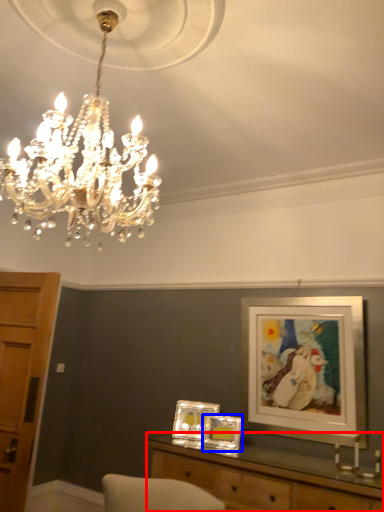
Question: Which object is closer to the camera taking this photo, table (highlighted by a red box) or picture frame (highlighted by a blue box)?

Choices:
 (A) table
 (B) picture frame

Answer: (A)